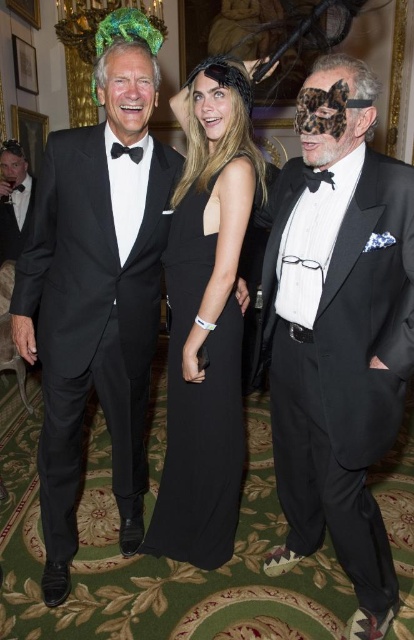
Question: Which of the following is the closest to the observer?

Choices:
 (A) matte black tuxedo at left
 (B) matte black tuxedo at right
 (C) black satin bow tie at left

Answer: (B)

Question: Does matte black tuxedo at left have a smaller size compared to black satin bow tie at center?

Choices:
 (A) no
 (B) yes

Answer: (A)

Question: Among these points, which one is nearest to the camera?

Choices:
 (A) (118, 147)
 (B) (182, 460)
 (C) (375, 458)
 (D) (21, 225)

Answer: (C)

Question: Which is farther from the black satin dress at center?

Choices:
 (A) matte black tuxedo at right
 (B) black satin bow tie at center

Answer: (B)

Question: Can you confirm if black satin bow tie at center is positioned to the left of black satin bow tie at left?

Choices:
 (A) no
 (B) yes

Answer: (A)

Question: Can you confirm if black satin tuxedo at left is wider than black satin dress at center?

Choices:
 (A) yes
 (B) no

Answer: (A)